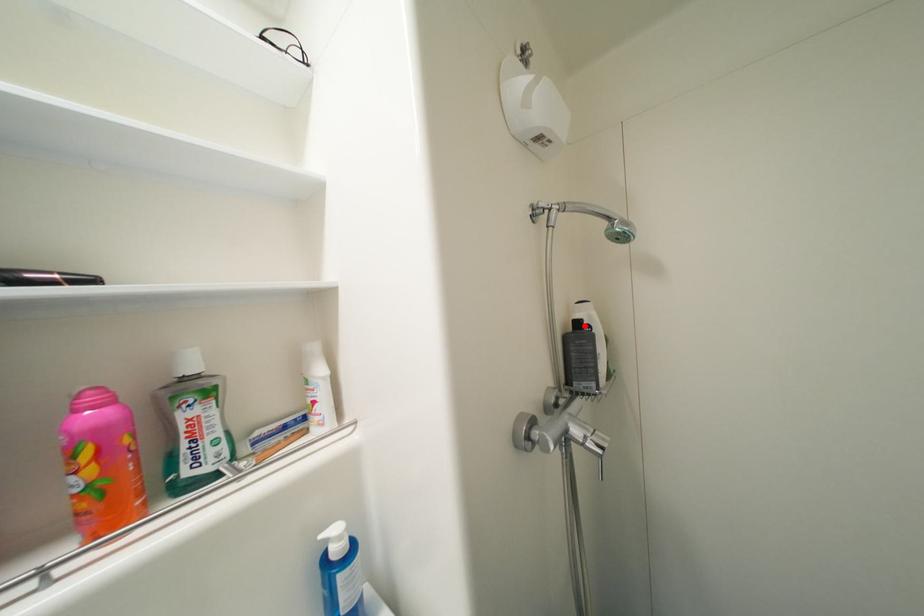
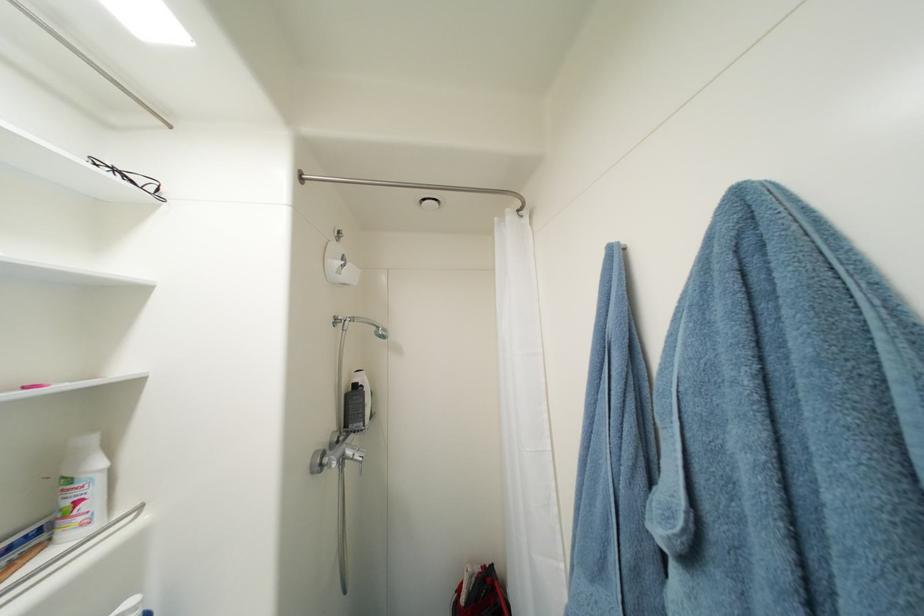
Locate, in the second image, the point that corresponds to the highlighted location in the first image.

(361, 387)